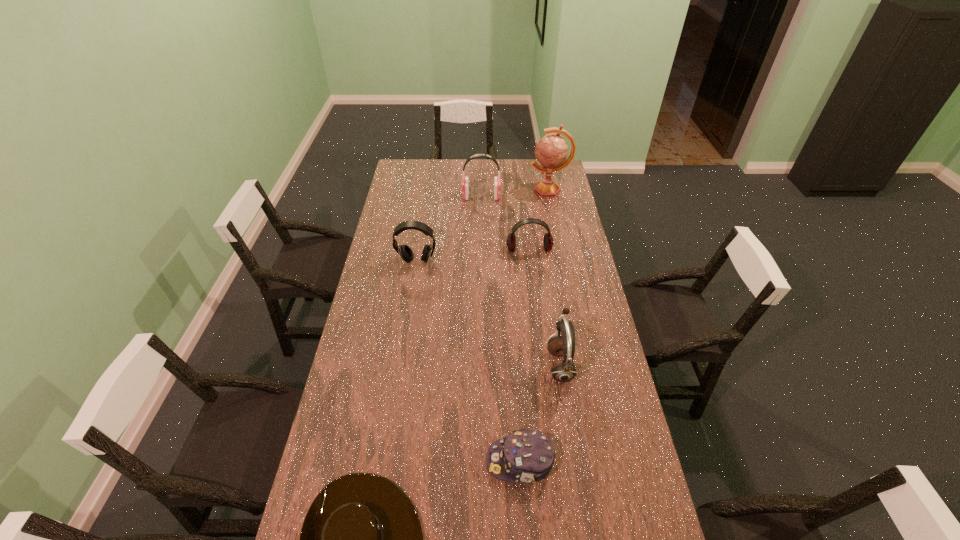
Identify the location of globe. (551, 151).

The image size is (960, 540). I want to click on the second earphone from left to right, so click(x=497, y=182).

At what (x,y) coordinates should I click in order to perform the action: click on the third nearest object. Please return your answer as a coordinate pair (x, y). Looking at the image, I should click on (563, 371).

The image size is (960, 540). Find the location of `the leftmost earphone`. the leftmost earphone is located at coordinates (405, 252).

Locate an element on the screen. the third shortest object is located at coordinates pos(548,242).

Locate an element on the screen. The height and width of the screenshot is (540, 960). headwear is located at coordinates (528, 456).

Identify the location of free location located on the front-facing side of the tallest object. This screenshot has width=960, height=540. (452, 191).

At what (x,y) coordinates should I click in order to perform the action: click on vacant space located 0.110m on the front-facing side of the tallest object. Please return your answer as a coordinate pair (x, y). This screenshot has width=960, height=540. Looking at the image, I should click on (508, 191).

You are a GUI agent. You are given a task and a screenshot of the screen. Output one action in this format:
    pyautogui.click(x=<x>, y=<y>)
    Task: Click on the vacant space located on the front-facing side of the tallest object
    The image size is (960, 540).
    Given the screenshot: What is the action you would take?
    pyautogui.click(x=464, y=191)

Locate an element on the screen. Image resolution: width=960 pixels, height=540 pixels. free space located 0.350m on the outer surface of the third earphone from right to left is located at coordinates (395, 197).